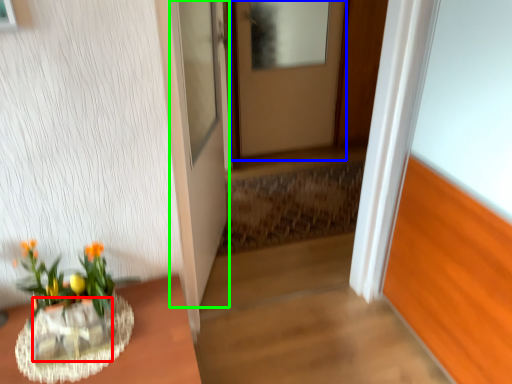
Question: Which is farther away from glass vase (highlighted by a red box)? door (highlighted by a blue box) or door (highlighted by a green box)?

Choices:
 (A) door
 (B) door

Answer: (A)